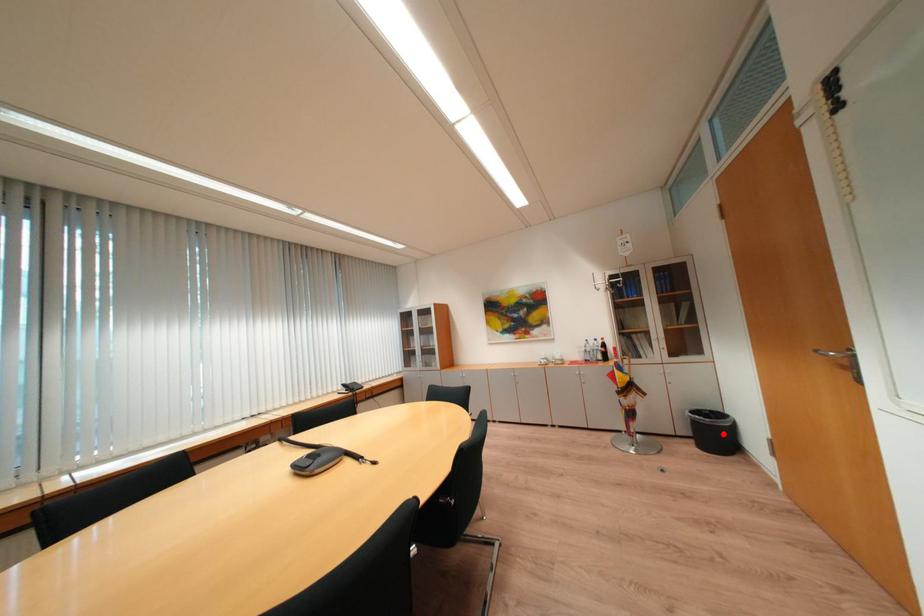
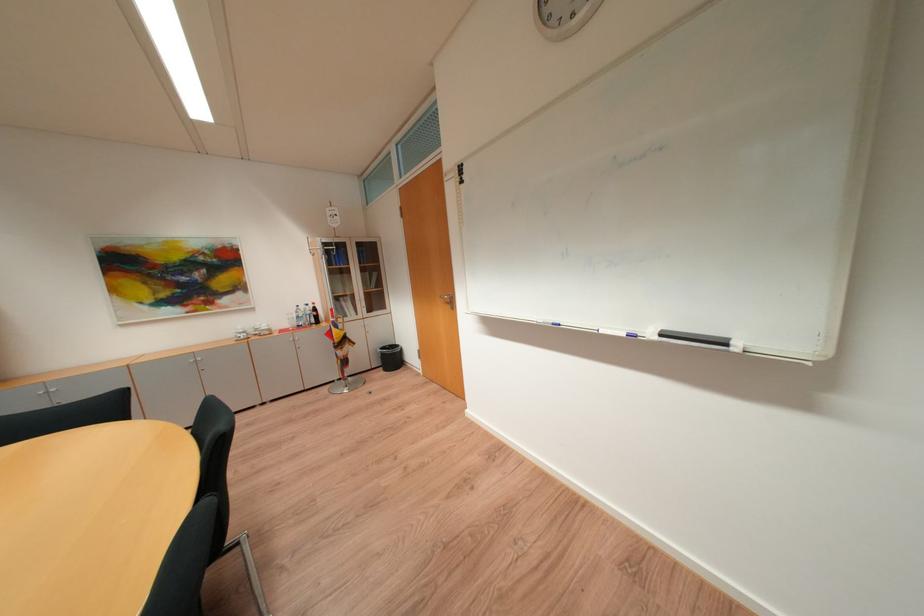
Question: I am providing you with two images of the same scene from different viewpoints. Given a red point in image1, look at the same physical point in image2. Is it:

Choices:
 (A) Closer to the viewpoint
 (B) Farther from the viewpoint

Answer: (B)